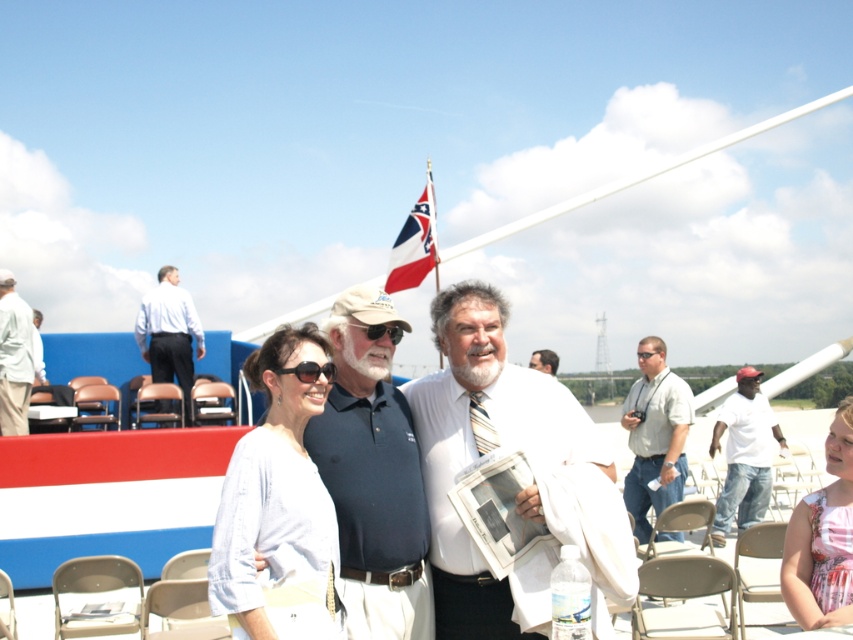
Between point (154, 332) and point (305, 374), which one is positioned behind?

The point (154, 332) is more distant.

Does light blue shirt at left appear on the right side of black plastic sunglasses at center?

In fact, light blue shirt at left is to the left of black plastic sunglasses at center.

Who is more distant from viewer, (x=144, y=339) or (x=279, y=369)?

The point (x=144, y=339) is more distant.

This screenshot has width=853, height=640. I want to click on light blue shirt at left, so click(x=169, y=332).

Which is more to the left, light blue fabric blouse at center or light brown leather jacket at center?

light blue fabric blouse at center

Which is more to the right, light blue fabric blouse at center or light brown leather jacket at center?

light brown leather jacket at center is more to the right.

At what (x,y) coordinates should I click in order to perform the action: click on light blue fabric blouse at center. Please return your answer as a coordinate pair (x, y). This screenshot has width=853, height=640. Looking at the image, I should click on (277, 508).

Between white striped tie at center and light blue shirt at left, which one has more height?

white striped tie at center

Does point (511, 433) come closer to viewer compared to point (177, 276)?

Yes, it is.

Between point (497, 593) and point (195, 353), which one is positioned behind?

The point (195, 353) is more distant.

Where is `white striped tie at center`? The height and width of the screenshot is (640, 853). white striped tie at center is located at coordinates (479, 445).